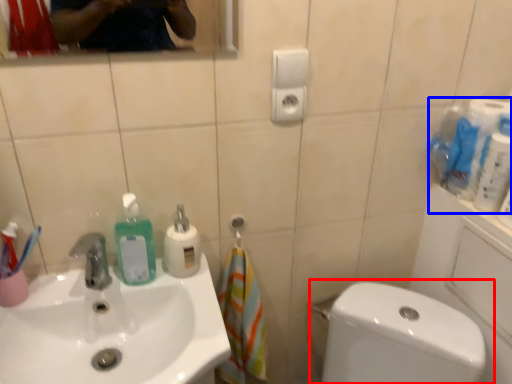
Question: Which point is closer to the camera, toilet (highlighted by a red box) or toilet paper (highlighted by a blue box)?

Choices:
 (A) toilet
 (B) toilet paper

Answer: (A)